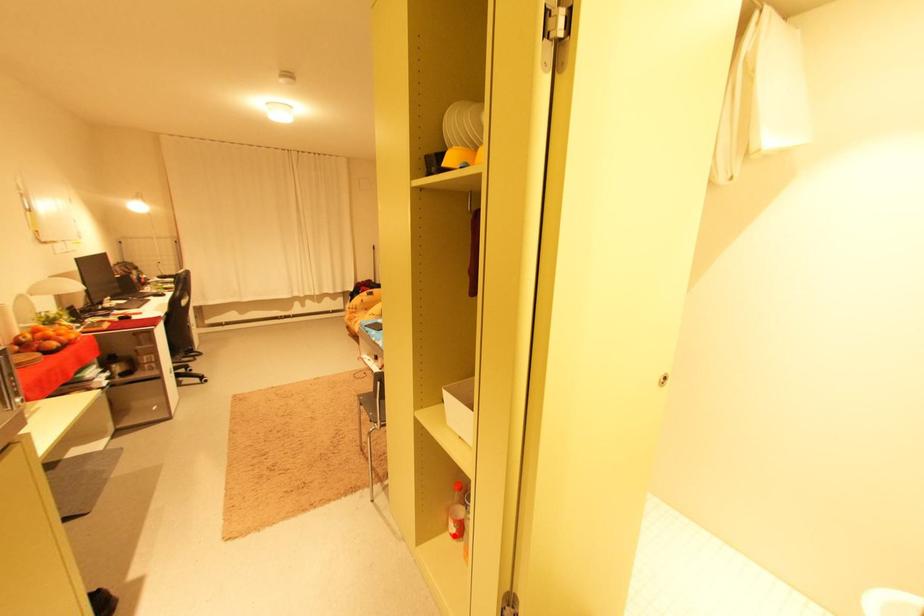
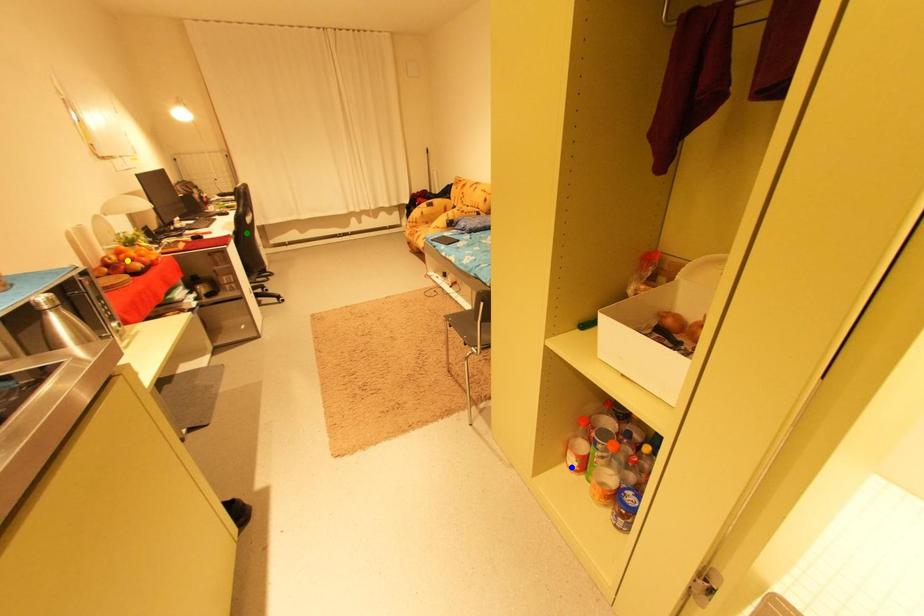
Question: I am providing you with two images of the same scene from different viewpoints. A red point is marked on the first image. You are given multiple points on the second image. In image 2, which mark is for the same physical point as the one in image 1?

Choices:
 (A) blue point
 (B) yellow point
 (C) green point

Answer: (A)